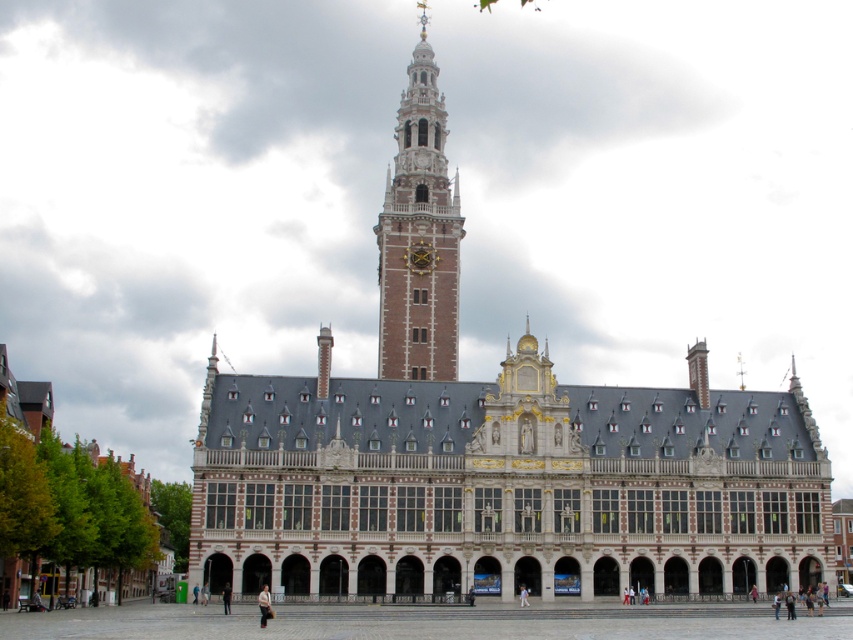
From the picture: You are an architect planning to place a dark gray fabric jacket at lower center near the white stone building at center. Considering the size difference between them, which object would occupy more horizontal space in the image?

The white stone building at center has a larger width than the dark gray fabric jacket at lower center, so it would occupy more horizontal space in the image.

You are a photographer standing at the base of the white stone building at center, and you want to capture a photo of the dark gray fabric jacket at lower center. Considering the height difference between the two, will you need to look up or down to frame the jacket in your camera?

The white stone building at center is taller than the dark gray fabric jacket at lower center, so you will need to look down to frame the jacket in your camera.

In the scene shown: You are standing at the base of the brown brick tower at center and want to walk to the light brown leather jacket at lower center. How far will you have to walk in feet?

The brown brick tower at center is 165.96 feet from the light brown leather jacket at lower center, so you will have to walk 165.96 feet to reach it.